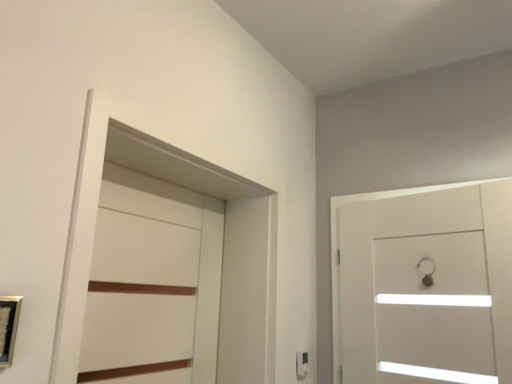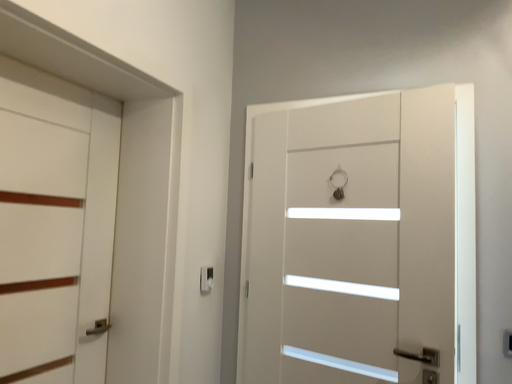
Question: Which way did the camera rotate in the video?

Choices:
 (A) rotated left
 (B) rotated right

Answer: (B)